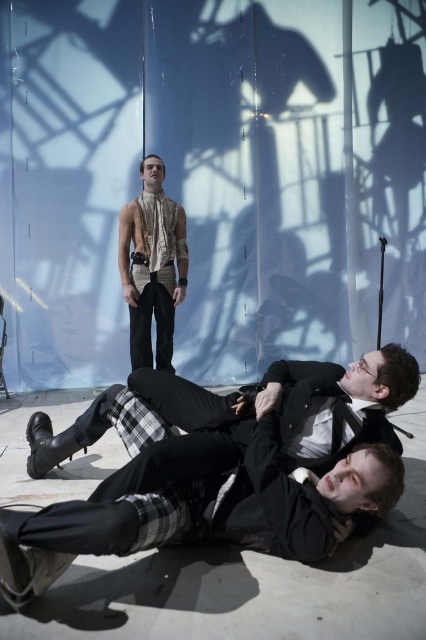
You are an observer analyzing the scene. The plaid wool pants at lower center and the matte beige shirt at center are part of two different people. Which clothing item is located to the right of the other?

The plaid wool pants at lower center is positioned on the right side of matte beige shirt at center.

You are observing the scene and want to know which of the two points, point (282, 468) or point (169, 275), is nearer to you. Can you determine this based on the spatial arrangement?

Point (282, 468) is closer to the viewer than point (169, 275), so it is the nearer one.